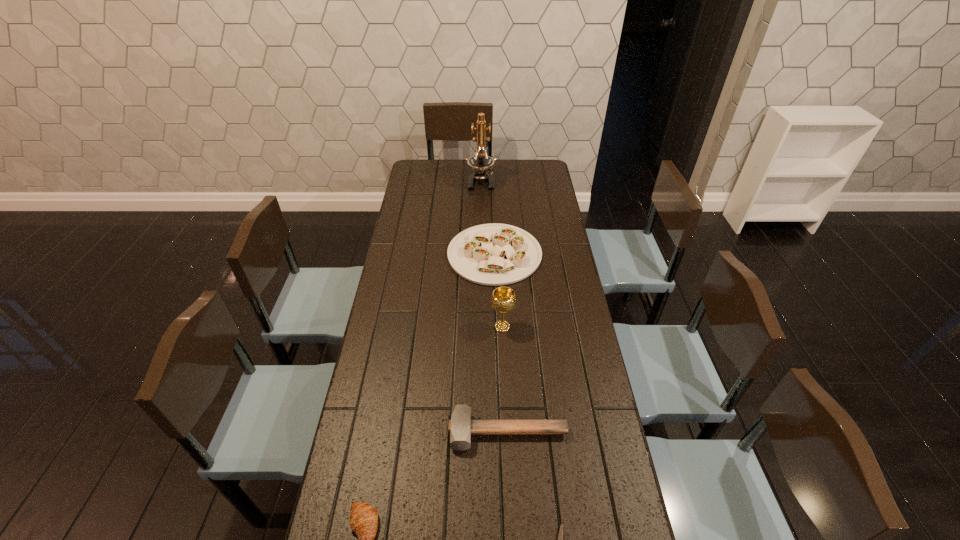
Where is `vacant area located on the left of the mallet`? The image size is (960, 540). vacant area located on the left of the mallet is located at coordinates (428, 432).

In order to click on object that is positioned at the far edge in this screenshot , I will do `click(480, 162)`.

Locate an element on the screen. This screenshot has width=960, height=540. platter that is at the right edge is located at coordinates (494, 254).

This screenshot has width=960, height=540. I want to click on mallet that is at the right edge, so click(x=460, y=427).

Where is `free space at the far edge of the desktop`? free space at the far edge of the desktop is located at coordinates (513, 168).

Locate an element on the screen. This screenshot has height=540, width=960. vacant space at the left edge of the desktop is located at coordinates (412, 245).

Find the location of a particular element. This screenshot has width=960, height=540. vacant position at the right edge of the desktop is located at coordinates (573, 265).

This screenshot has height=540, width=960. In the image, there is a desktop. Identify the location of vacant space at the far left corner. (427, 164).

You are a GUI agent. You are given a task and a screenshot of the screen. Output one action in this format:
    pyautogui.click(x=<x>, y=<y>)
    Task: Click on the free space at the far right corner of the desktop
    This screenshot has width=960, height=540.
    Given the screenshot: What is the action you would take?
    pyautogui.click(x=521, y=166)

This screenshot has width=960, height=540. What are the coordinates of `empty space between the second farthest object and the fourth tallest object` in the screenshot? It's located at (x=501, y=343).